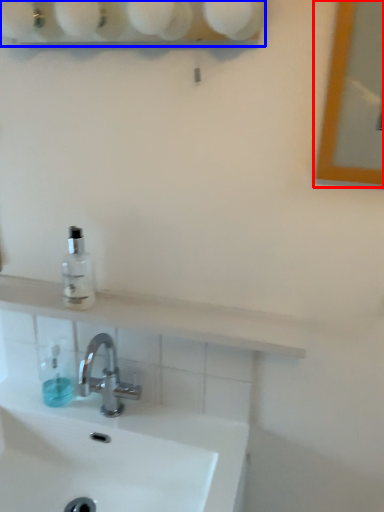
Question: Which of the following is the farthest to the observer, mirror (highlighted by a red box) or shelf (highlighted by a blue box)?

Choices:
 (A) mirror
 (B) shelf

Answer: (B)